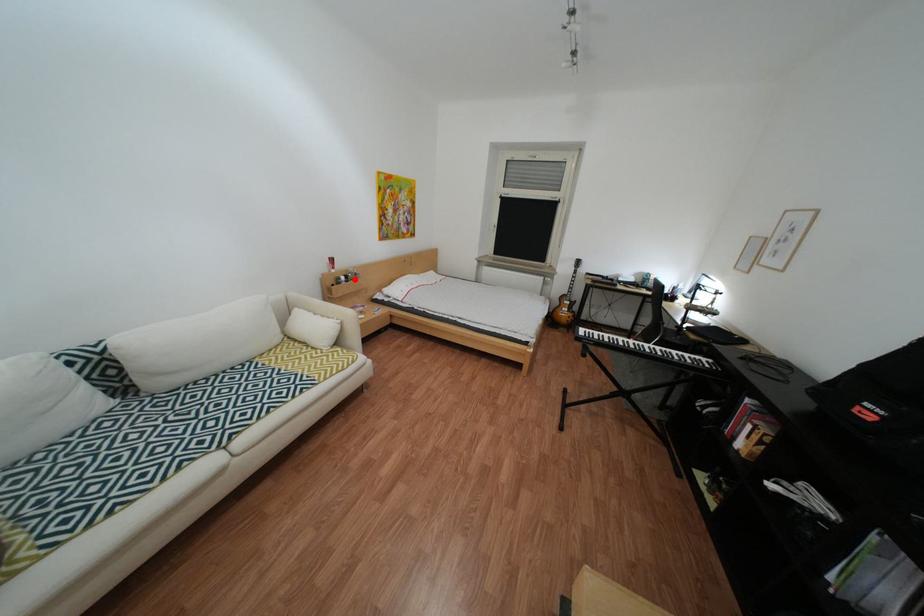
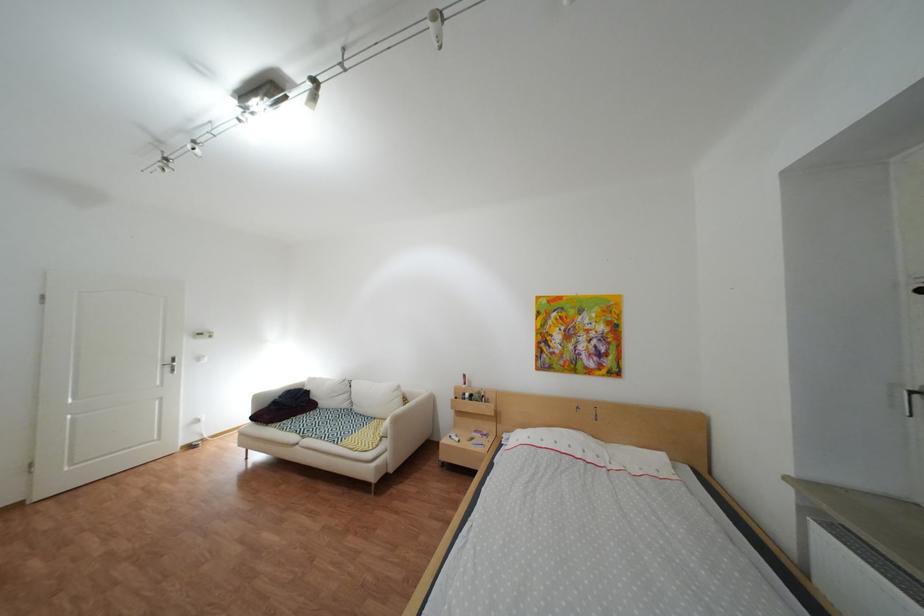
Question: I am providing you with two images of the same scene from different viewpoints. In image1, a red point is highlighted. Considering the same 3D point in image2, which of the following is correct?

Choices:
 (A) It is closer
 (B) It is farther

Answer: (B)